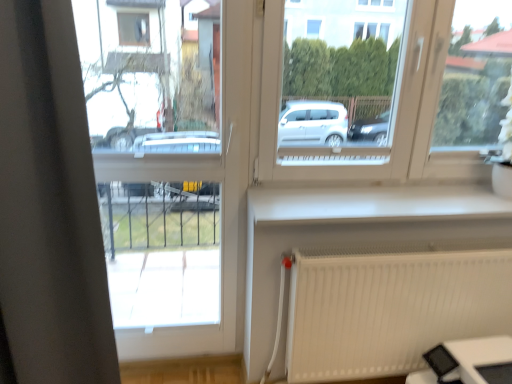
Question: Is white smooth window sill at center positioned with its back to white plastic window frame at left?

Choices:
 (A) no
 (B) yes

Answer: (A)

Question: Can you confirm if white smooth window sill at center is positioned to the right of white plastic window frame at left?

Choices:
 (A) no
 (B) yes

Answer: (B)

Question: Can you confirm if white smooth window sill at center is shorter than white plastic window frame at left?

Choices:
 (A) no
 (B) yes

Answer: (B)

Question: Is white smooth window sill at center positioned behind white plastic window frame at left?

Choices:
 (A) yes
 (B) no

Answer: (A)

Question: From a real-world perspective, is white smooth window sill at center beneath white plastic window frame at left?

Choices:
 (A) no
 (B) yes

Answer: (A)

Question: Considering the positions of point (264, 56) and point (114, 304), is point (264, 56) closer or farther from the camera than point (114, 304)?

Choices:
 (A) farther
 (B) closer

Answer: (B)

Question: Is white plastic window at center situated inside white plastic window frame at left or outside?

Choices:
 (A) inside
 (B) outside

Answer: (B)

Question: Considering the positions of white plastic window at center and white plastic window frame at left in the image, is white plastic window at center taller or shorter than white plastic window frame at left?

Choices:
 (A) short
 (B) tall

Answer: (A)

Question: Relative to white plastic window frame at left, is white plastic window at center in front or behind?

Choices:
 (A) front
 (B) behind

Answer: (B)

Question: Considering the positions of white plastic window frame at left and white smooth window sill at center in the image, is white plastic window frame at left taller or shorter than white smooth window sill at center?

Choices:
 (A) tall
 (B) short

Answer: (A)

Question: Which is correct: white plastic window frame at left is inside white smooth window sill at center, or outside of it?

Choices:
 (A) outside
 (B) inside

Answer: (A)

Question: Looking at their shapes, would you say white plastic window frame at left is wider or thinner than white smooth window sill at center?

Choices:
 (A) wide
 (B) thin

Answer: (B)

Question: Based on their sizes in the image, would you say white plastic window frame at left is bigger or smaller than white smooth window sill at center?

Choices:
 (A) big
 (B) small

Answer: (A)

Question: From a real-world perspective, is white plastic window at center above or below white smooth window sill at center?

Choices:
 (A) below
 (B) above

Answer: (B)

Question: In terms of width, does white plastic window at center look wider or thinner when compared to white smooth window sill at center?

Choices:
 (A) wide
 (B) thin

Answer: (B)